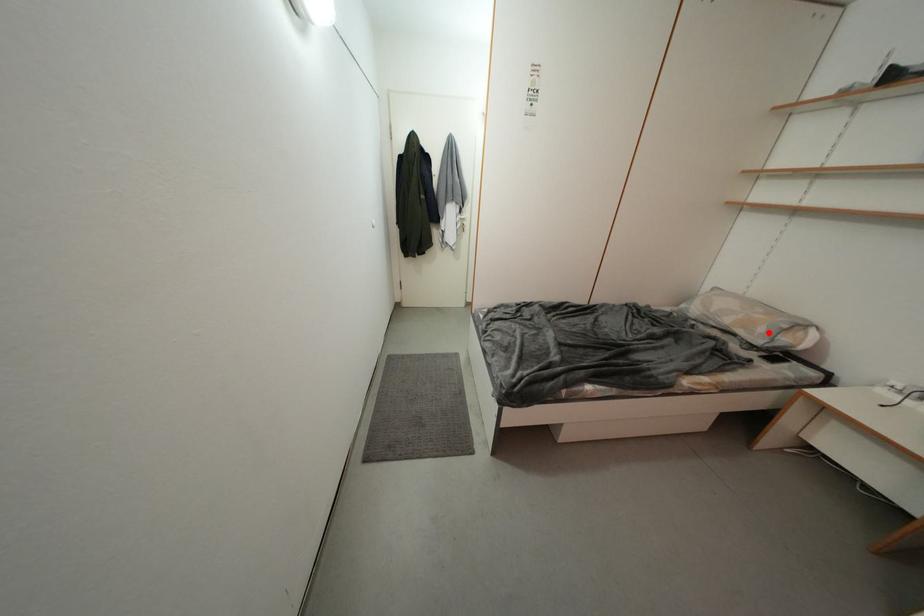
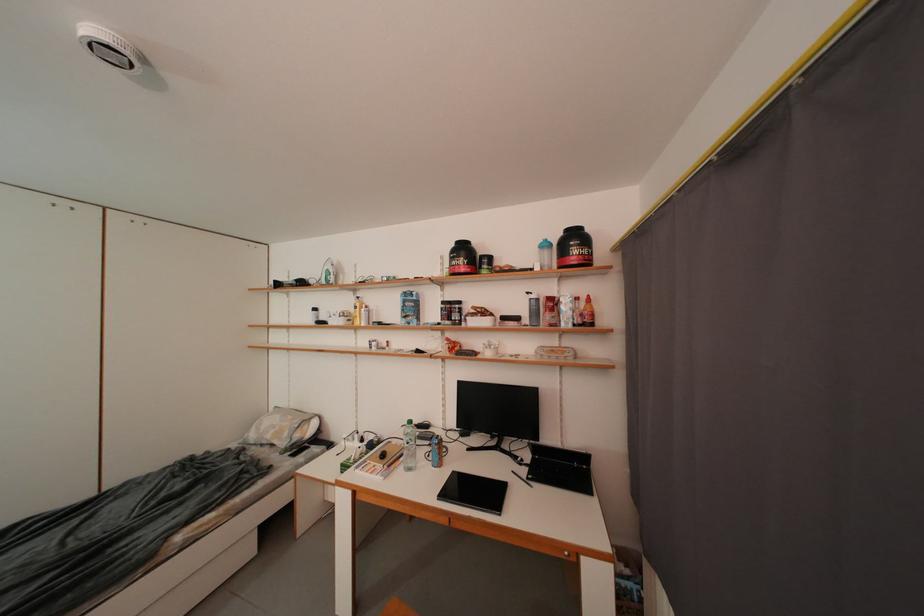
In the second image, find the point that corresponds to the highlighted location in the first image.

(294, 438)